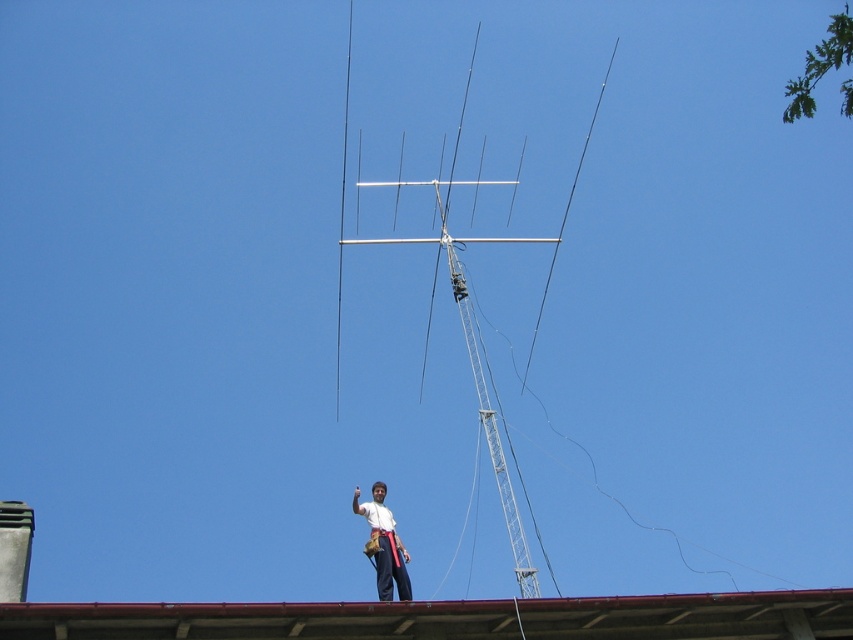
Question: From the image, what is the correct spatial relationship of red metal roof at center in relation to white fabric shirt at center?

Choices:
 (A) left
 (B) right

Answer: (A)

Question: Observing the image, what is the correct spatial positioning of red metal roof at center in reference to white fabric shirt at center?

Choices:
 (A) right
 (B) left

Answer: (B)

Question: Does red metal roof at center appear on the left side of white fabric shirt at center?

Choices:
 (A) yes
 (B) no

Answer: (A)